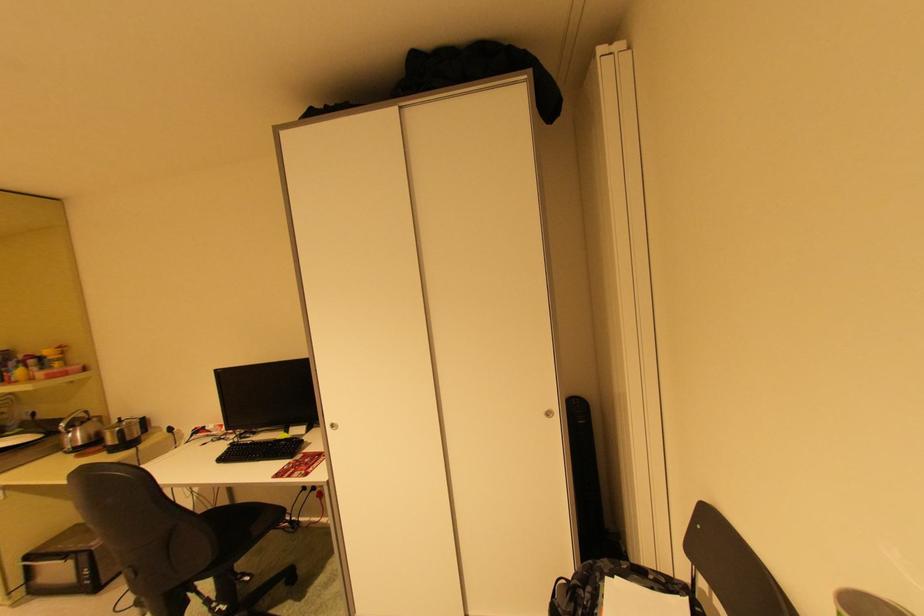
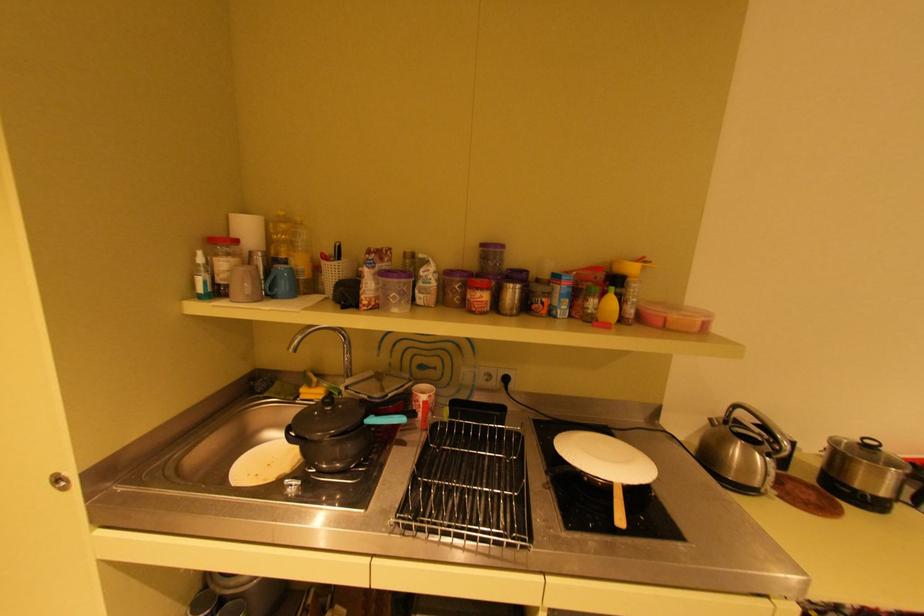
In the scene shown: The images are taken continuously from a first-person perspective. In which direction are you moving?

The cameraman walked toward left, forward.